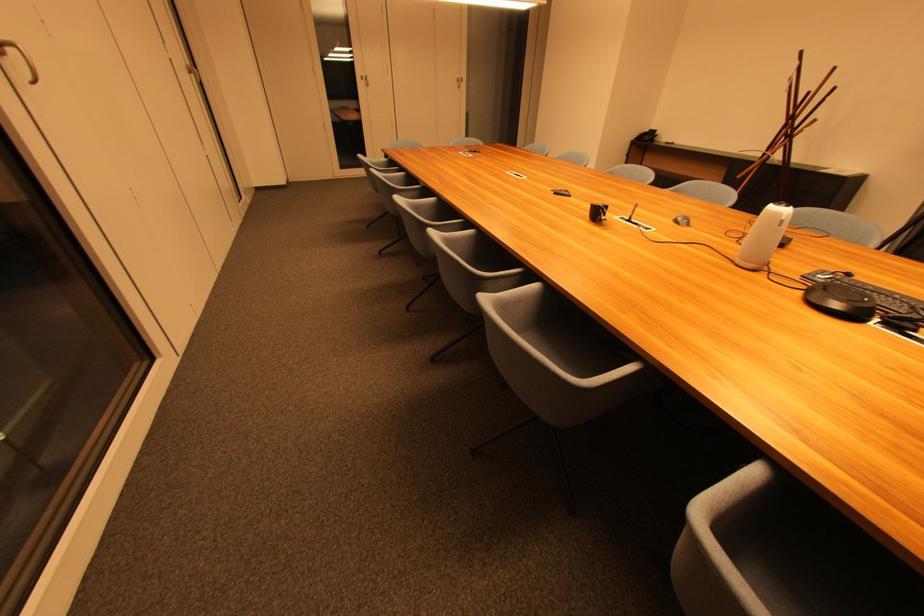
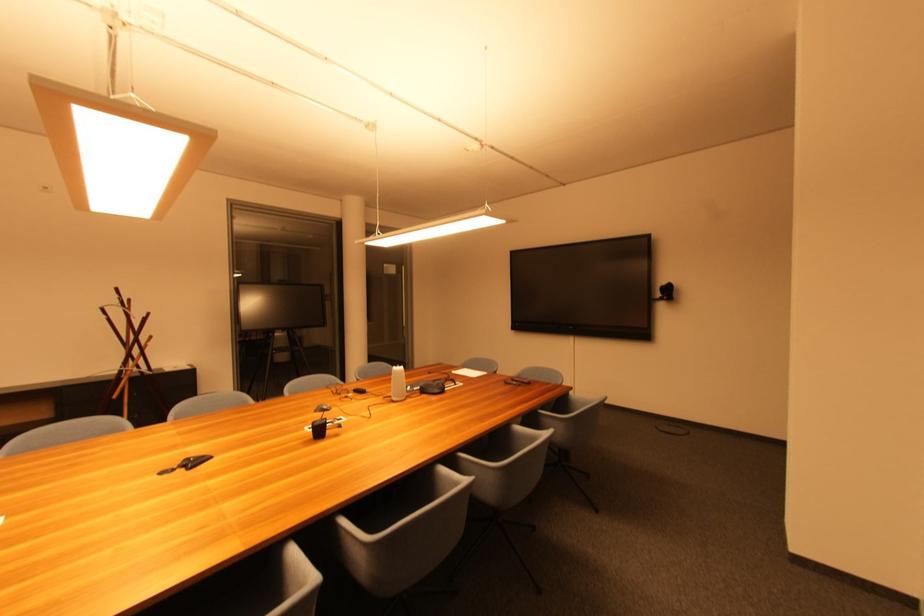
Find the pixel in the second image that matches [602,216] in the first image.

(324, 432)